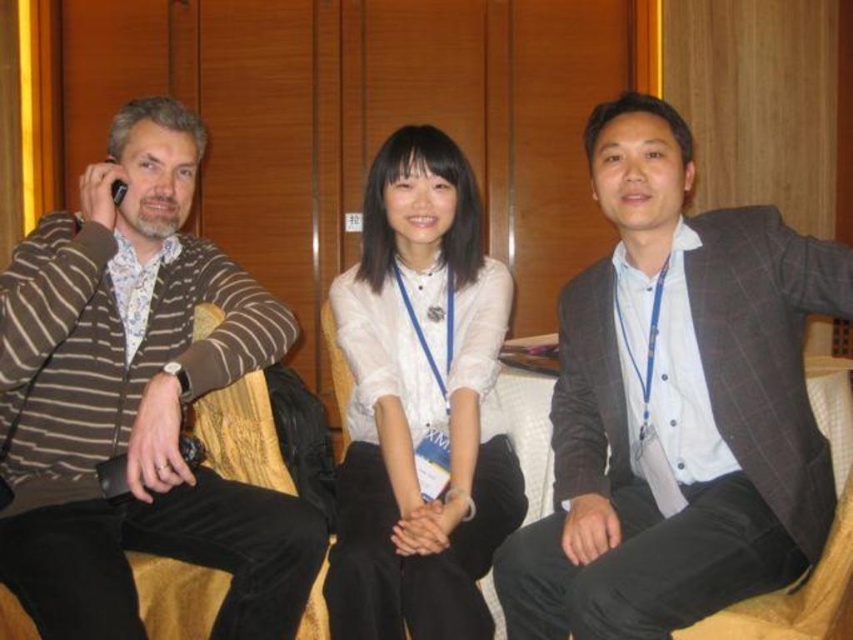
Between brown striped sweater at left and white matte shirt at center, which one is positioned higher?

brown striped sweater at left is above.

The image size is (853, 640). Describe the element at coordinates (136, 401) in the screenshot. I see `brown striped sweater at left` at that location.

Which is behind, point (4, 404) or point (430, 164)?

The point (430, 164) is more distant.

Locate an element on the screen. The width and height of the screenshot is (853, 640). brown striped sweater at left is located at coordinates (136, 401).

Does gray checkered suit at center lie in front of white matte shirt at center?

Yes.

Between gray checkered suit at center and white matte shirt at center, which one has less height?

With less height is gray checkered suit at center.

Is point (750, 253) positioned in front of point (387, 616)?

Yes.

Identify the location of gray checkered suit at center. The image size is (853, 640). (676, 403).

Measure the distance between gray checkered suit at center and brown striped sweater at left.

gray checkered suit at center and brown striped sweater at left are 33.21 inches apart.

Is gray checkered suit at center to the left of brown striped sweater at left from the viewer's perspective?

In fact, gray checkered suit at center is to the right of brown striped sweater at left.

Which is behind, point (605, 342) or point (184, 266)?

The point (184, 266) is behind.

In order to click on gray checkered suit at center in this screenshot , I will do `click(676, 403)`.